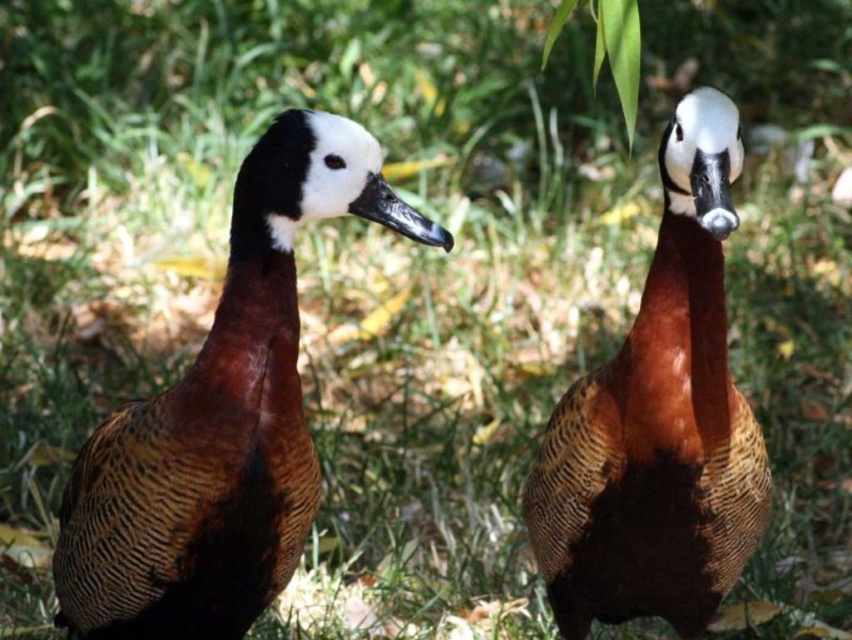
Find the location of a particular element. Image resolution: width=852 pixels, height=640 pixels. brown textured duck at left is located at coordinates click(222, 419).

From the picture: Is brown textured duck at left to the left of brown textured duck at center from the viewer's perspective?

Indeed, brown textured duck at left is positioned on the left side of brown textured duck at center.

I want to click on brown textured duck at left, so click(x=222, y=419).